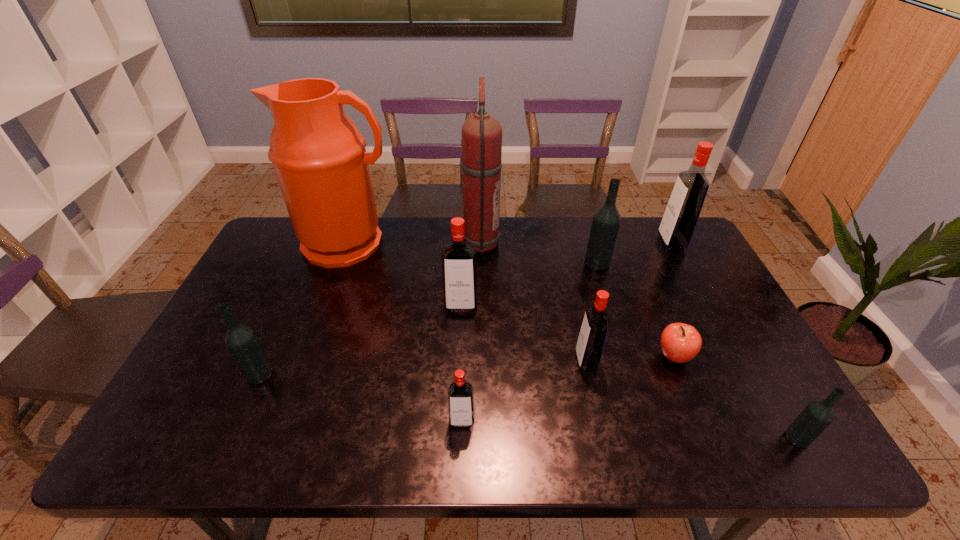
Find the location of `water jug`. water jug is located at coordinates (319, 157).

This screenshot has height=540, width=960. I want to click on red fire extinguisher, so click(481, 134).

Find the location of a particular element. The height and width of the screenshot is (540, 960). the farthest vodka is located at coordinates (682, 212).

Where is `the rightmost red vodka`? This screenshot has width=960, height=540. the rightmost red vodka is located at coordinates 682,212.

The width and height of the screenshot is (960, 540). What are the coordinates of `the biggest black vodka` in the screenshot? It's located at (606, 220).

At what (x,y) coordinates should I click in order to perform the action: click on the second black vodka from right to left. Please return your answer as a coordinate pair (x, y). Image resolution: width=960 pixels, height=540 pixels. Looking at the image, I should click on (606, 220).

At what (x,y) coordinates should I click in order to perform the action: click on the second biggest red vodka. Please return your answer as a coordinate pair (x, y). Looking at the image, I should click on (459, 258).

Where is `the third nearest red vodka`? The height and width of the screenshot is (540, 960). the third nearest red vodka is located at coordinates (459, 258).

Find the location of `the second biggest black vodka`. the second biggest black vodka is located at coordinates pos(241,340).

You are a GUI agent. You are given a task and a screenshot of the screen. Output one action in this format:
    pyautogui.click(x=<x>, y=<y>)
    Task: Click on the leftmost vodka
    
    Given the screenshot: What is the action you would take?
    pyautogui.click(x=241, y=340)